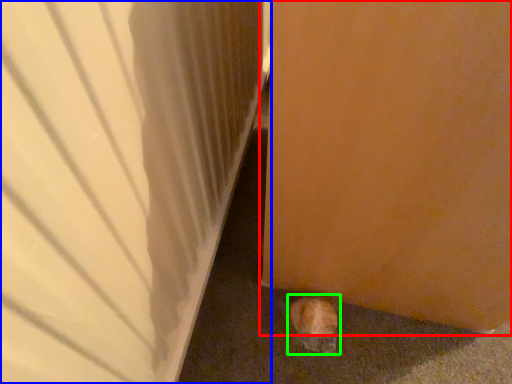
Question: Considering the real-world distances, which object is farthest from door (highlighted by a red box)? door (highlighted by a blue box) or animal (highlighted by a green box)?

Choices:
 (A) door
 (B) animal

Answer: (B)